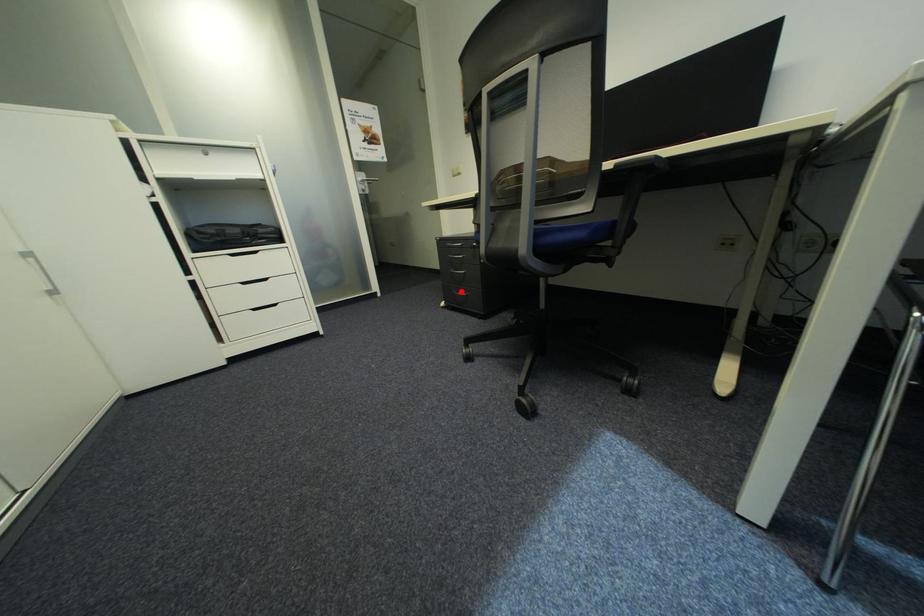
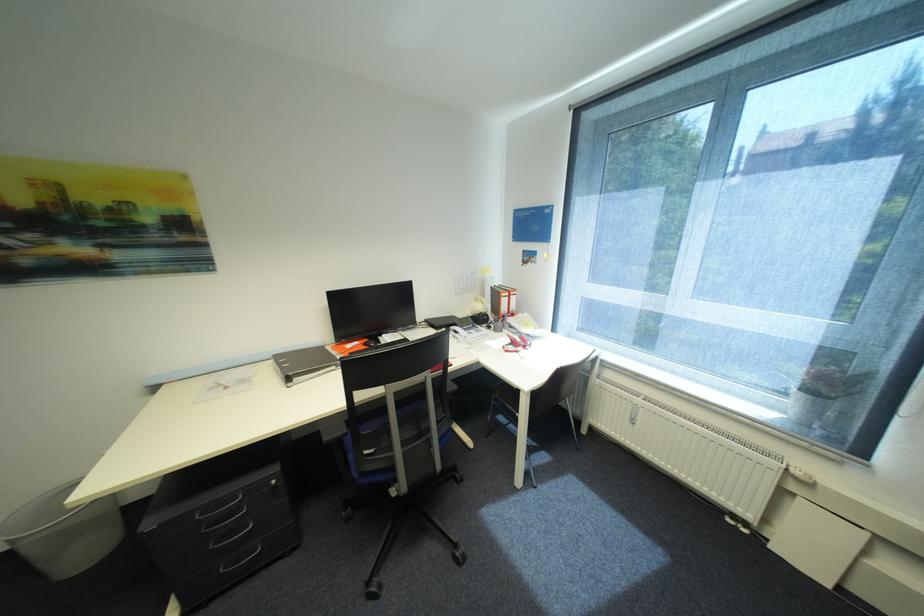
Where in the second image is the point corresponding to the highlighted location from the first image?

(229, 570)